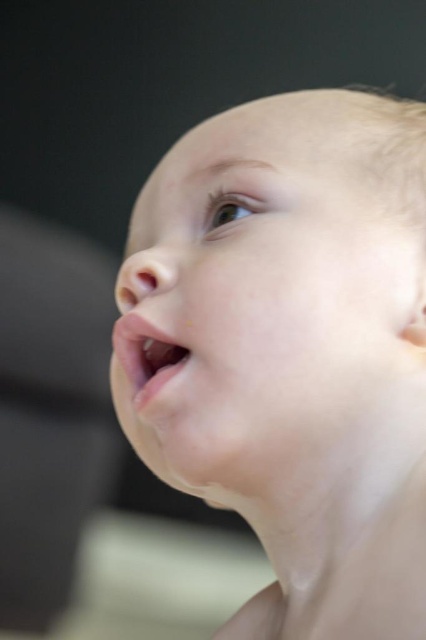
Between smooth skin face at center and pink smooth lips at center, which one is positioned lower?

Positioned lower is pink smooth lips at center.

The image size is (426, 640). I want to click on smooth skin face at center, so [x=258, y=296].

Find the location of a particular element. This screenshot has width=426, height=640. smooth skin face at center is located at coordinates (258, 296).